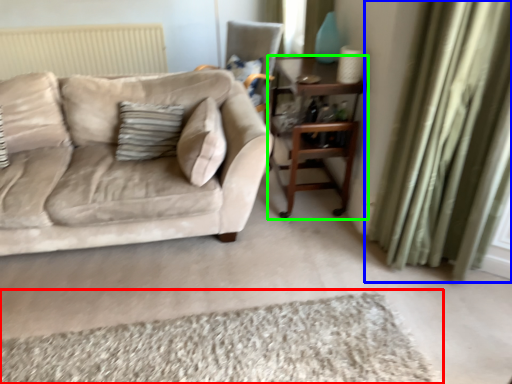
Question: Which object is the closest to the plain (highlighted by a red box)? Choose among these: curtain (highlighted by a blue box) or table (highlighted by a green box).

Choices:
 (A) curtain
 (B) table

Answer: (A)